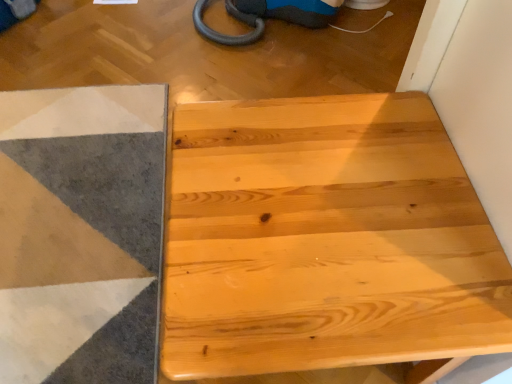
Question: From the image's perspective, would you say natural wood table at center is positioned over soft gray carpet at lower left?

Choices:
 (A) yes
 (B) no

Answer: (B)

Question: Is natural wood table at center closer to the viewer compared to soft gray carpet at lower left?

Choices:
 (A) yes
 (B) no

Answer: (A)

Question: Is natural wood table at center outside soft gray carpet at lower left?

Choices:
 (A) no
 (B) yes

Answer: (B)

Question: Does natural wood table at center appear on the right side of soft gray carpet at lower left?

Choices:
 (A) yes
 (B) no

Answer: (A)

Question: Can soft gray carpet at lower left be found inside natural wood table at center?

Choices:
 (A) yes
 (B) no

Answer: (B)

Question: Can you confirm if natural wood table at center is positioned to the left of soft gray carpet at lower left?

Choices:
 (A) yes
 (B) no

Answer: (B)

Question: Can you confirm if soft gray carpet at lower left is smaller than natural wood table at center?

Choices:
 (A) no
 (B) yes

Answer: (B)

Question: Is soft gray carpet at lower left placed right next to natural wood table at center?

Choices:
 (A) no
 (B) yes

Answer: (A)

Question: From a real-world perspective, is soft gray carpet at lower left below natural wood table at center?

Choices:
 (A) no
 (B) yes

Answer: (B)

Question: Is soft gray carpet at lower left to the left of natural wood table at center from the viewer's perspective?

Choices:
 (A) yes
 (B) no

Answer: (A)

Question: Is soft gray carpet at lower left thinner than natural wood table at center?

Choices:
 (A) no
 (B) yes

Answer: (A)

Question: Can you confirm if soft gray carpet at lower left is shorter than natural wood table at center?

Choices:
 (A) no
 (B) yes

Answer: (B)

Question: Considering the positions of point (283, 230) and point (126, 240), is point (283, 230) closer or farther from the camera than point (126, 240)?

Choices:
 (A) farther
 (B) closer

Answer: (B)